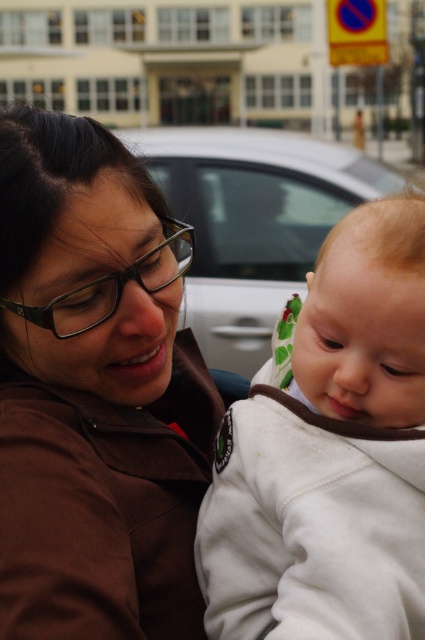
Does brown fabric at center appear under white soft baby at center?

No.

Who is shorter, brown fabric at center or white soft baby at center?

white soft baby at center is shorter.

What do you see at coordinates (102, 476) in the screenshot? I see `brown fabric at center` at bounding box center [102, 476].

I want to click on brown fabric at center, so click(x=102, y=476).

This screenshot has height=640, width=425. Identify the location of brown fabric at center. (102, 476).

Find the location of a particular element. This screenshot has height=640, width=425. brown fabric at center is located at coordinates (102, 476).

Can you confirm if white soft baby at center is bigger than white glossy car at center?

No.

Does white soft baby at center appear over white glossy car at center?

No, white soft baby at center is not above white glossy car at center.

Which is behind, point (410, 400) or point (197, 189)?

The point (197, 189) is more distant.

The image size is (425, 640). Find the location of `white soft baby at center`. white soft baby at center is located at coordinates (328, 452).